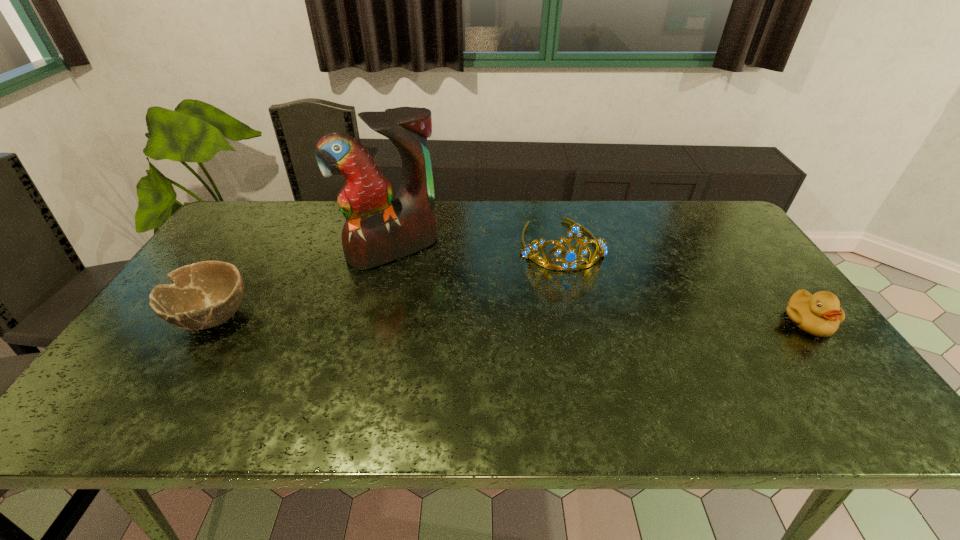
At what (x,y) coordinates should I click in order to perform the action: click on free space located at the face of the second object from left to right. Please return your answer as a coordinate pair (x, y). The image size is (960, 540). Looking at the image, I should click on (422, 285).

Locate an element on the screen. This screenshot has height=540, width=960. vacant point located at the face of the second object from left to right is located at coordinates (451, 326).

At what (x,y) coordinates should I click in order to perform the action: click on free point located 0.280m at the face of the second object from left to right. Please return your answer as a coordinate pair (x, y). The image size is (960, 540). Looking at the image, I should click on (454, 331).

Locate an element on the screen. This screenshot has height=540, width=960. tiara that is at the far edge is located at coordinates (569, 263).

At what (x,y) coordinates should I click in order to perform the action: click on parrot that is at the far edge. Please return your answer as a coordinate pair (x, y). Image resolution: width=960 pixels, height=540 pixels. Looking at the image, I should click on (378, 229).

The image size is (960, 540). In order to click on object at the left edge in this screenshot , I will do click(x=202, y=295).

Find the location of a particular element. object that is at the right edge is located at coordinates (820, 314).

Where is `free space at the far edge of the desktop`? This screenshot has width=960, height=540. free space at the far edge of the desktop is located at coordinates (648, 225).

The image size is (960, 540). In order to click on free region at the near edge of the desktop in this screenshot , I will do pyautogui.click(x=571, y=377).

The width and height of the screenshot is (960, 540). What are the coordinates of `blank space at the left edge` in the screenshot? It's located at (146, 329).